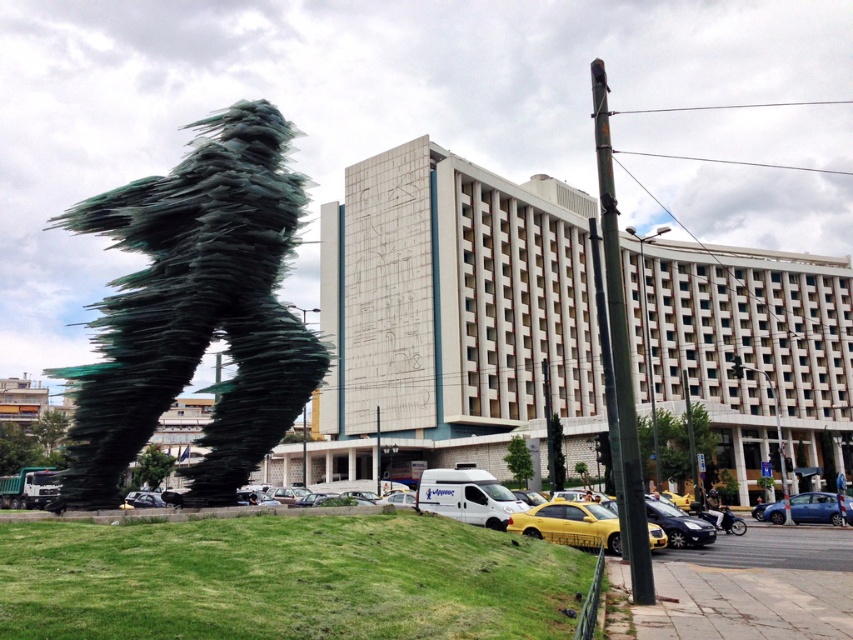
You are a pedestrian standing at the edge of the sculpture and want to cross the road to reach the modern building. Which car, the yellow matte car at lower center or the shiny black sedan at lower center, is closer to you?

The yellow matte car at lower center is closer to you because it is positioned to the left of the shiny black sedan at lower center, and in this context, leftward placement typically indicates proximity.

You are a photographer standing at the edge of the urban scene. You want to capture both the green glass sculpture at left and the shiny black sedan at lower center in the same frame. Which object should you focus on first to ensure both are in focus?

The green glass sculpture at left is taller than the shiny black sedan at lower center, so focusing on the sculpture first will help ensure both objects are in focus since it occupies more space in the frame.

You are a pedestrian standing at the base of the sculpture and want to cross the road to reach the modern building. There are two cars in your path. Which car, the yellow matte car at lower center or the shiny black sedan at lower center, is closer to you and should be avoided first?

The yellow matte car at lower center is closer to the viewer than the shiny black sedan at lower center, so you should avoid it first.